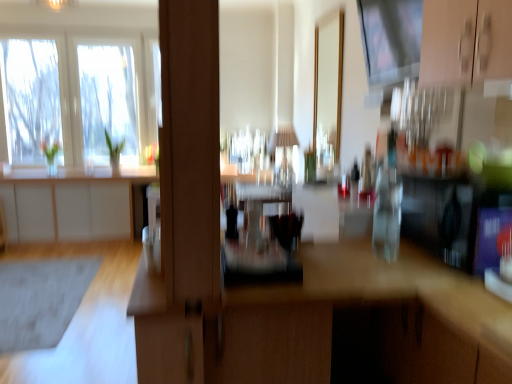
The width and height of the screenshot is (512, 384). Find the location of `empty space that is ontop of clear glass window at upper left (from a real-world perspective)`. empty space that is ontop of clear glass window at upper left (from a real-world perspective) is located at coordinates (69, 31).